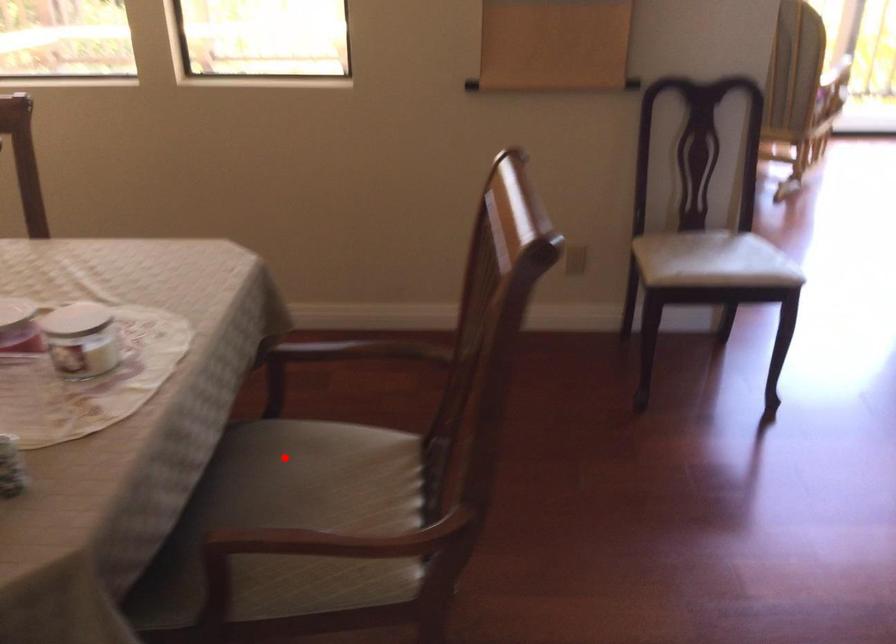
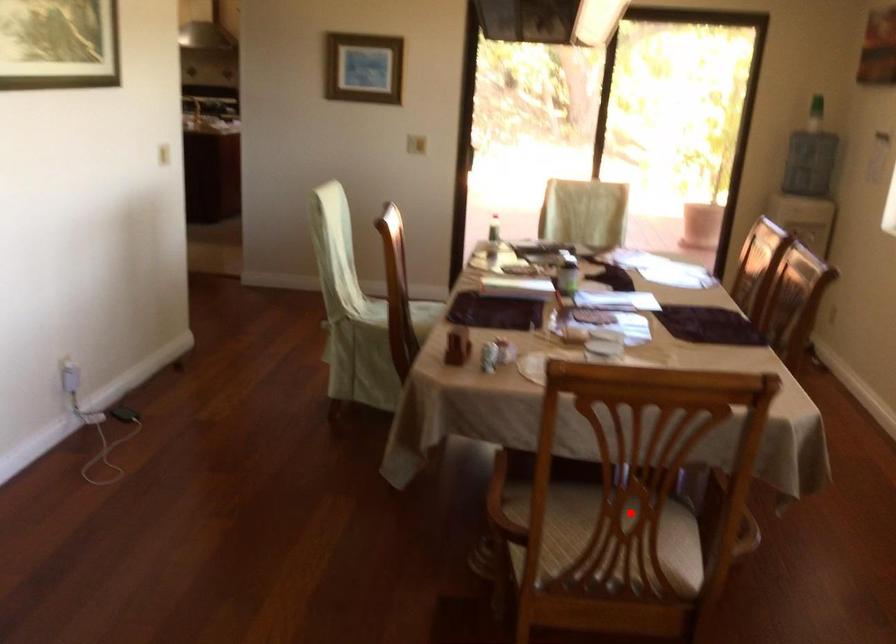
I am providing you with two images of the same scene from different viewpoints. A red point is marked on the first image and another point is marked on the second image. Is the marked point in image1 the same physical position as the marked point in image2?

Yes